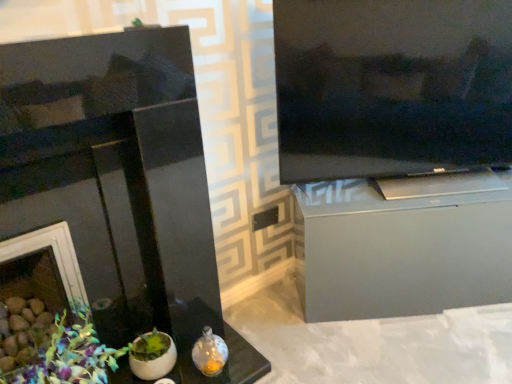
What is the approximate width of black glossy fireplace at left?

16.51 inches.

The height and width of the screenshot is (384, 512). What do you see at coordinates (120, 183) in the screenshot?
I see `black glossy fireplace at left` at bounding box center [120, 183].

This screenshot has width=512, height=384. What do you see at coordinates (72, 356) in the screenshot?
I see `matte green plant at lower left` at bounding box center [72, 356].

Find the location of `matte green plant at lower left`. matte green plant at lower left is located at coordinates (72, 356).

Locate an element on the screen. This screenshot has width=512, height=384. satin silver cabinet at right is located at coordinates (403, 245).

In the image, is black glossy television at upper right positioned in front of or behind satin silver cabinet at right?

black glossy television at upper right is in front of satin silver cabinet at right.

Based on the photo, is black glossy television at upper right facing towards satin silver cabinet at right?

No.

Is point (496, 160) positioned in front of point (390, 186)?

No, it is not.

Between black glossy television at upper right and black glossy fireplace at left, which one has smaller size?

black glossy television at upper right.

From the image's perspective, does black glossy television at upper right appear lower than black glossy fireplace at left?

No, from the image's perspective, black glossy television at upper right is not below black glossy fireplace at left.

Find the location of a particular element. This screenshot has height=384, width=512. fireplace that appears on the left of black glossy television at upper right is located at coordinates (120, 183).

Looking at this image, what's the angular difference between black glossy television at upper right and black glossy fireplace at left's facing directions?

They differ by 33.8 degrees in their facing directions.

Locate an element on the screen. cabinetry lying on the right of black glossy television at upper right is located at coordinates (403, 245).

Is satin silver cabinet at right looking in the opposite direction of black glossy television at upper right?

No, satin silver cabinet at right is not facing away from black glossy television at upper right.

In the scene shown: Is satin silver cabinet at right in front of black glossy television at upper right?

That is False.

Considering the sizes of matte green plant at lower left and satin silver cabinet at right in the image, is matte green plant at lower left wider or thinner than satin silver cabinet at right?

Considering their sizes, matte green plant at lower left looks broader than satin silver cabinet at right.

Is matte green plant at lower left with satin silver cabinet at right?

No, matte green plant at lower left is not next to satin silver cabinet at right.

Is the depth of matte green plant at lower left greater than that of satin silver cabinet at right?

No.

Which is behind, point (86, 320) or point (336, 243)?

The point (336, 243) is more distant.

Is matte green plant at lower left far from black glossy fireplace at left?

No, there isn't a large distance between matte green plant at lower left and black glossy fireplace at left.

From a real-world perspective, is matte green plant at lower left located higher than black glossy fireplace at left?

No, from a real-world perspective, matte green plant at lower left is not over black glossy fireplace at left

Image resolution: width=512 pixels, height=384 pixels. Find the location of `floral arrangement below the black glossy television at upper right (from the image's perspective)`. floral arrangement below the black glossy television at upper right (from the image's perspective) is located at coordinates (72, 356).

Does matte green plant at lower left have a larger size compared to black glossy television at upper right?

Incorrect, matte green plant at lower left is not larger than black glossy television at upper right.

Consider the image. Considering the sizes of matte green plant at lower left and black glossy television at upper right in the image, is matte green plant at lower left taller or shorter than black glossy television at upper right?

Clearly, matte green plant at lower left is shorter compared to black glossy television at upper right.

Which object is closer to the camera, matte green plant at lower left or black glossy television at upper right?

Positioned in front is matte green plant at lower left.

Is black glossy fireplace at left at the right side of matte green plant at lower left?

Indeed, black glossy fireplace at left is positioned on the right side of matte green plant at lower left.

From the image's perspective, which one is positioned lower, black glossy fireplace at left or matte green plant at lower left?

matte green plant at lower left, from the image's perspective.

Does black glossy fireplace at left have a greater height compared to matte green plant at lower left?

Yes.

Find the location of a particular element. fireplace above the matte green plant at lower left (from the image's perspective) is located at coordinates (120, 183).

In the image, there is a satin silver cabinet at right. What are the coordinates of `television above it (from the image's perspective)` in the screenshot? It's located at (391, 86).

At what (x,y) coordinates should I click in order to perform the action: click on television above the black glossy fireplace at left (from a real-world perspective). Please return your answer as a coordinate pair (x, y). The height and width of the screenshot is (384, 512). Looking at the image, I should click on (391, 86).

Looking at the image, which one is located closer to satin silver cabinet at right, black glossy television at upper right or black glossy fireplace at left?

Among the two, black glossy television at upper right is located nearer to satin silver cabinet at right.

From the image, which object appears to be farther from matte green plant at lower left, satin silver cabinet at right or black glossy television at upper right?

Based on the image, black glossy television at upper right appears to be further to matte green plant at lower left.

Consider the image. From the image, which object appears to be farther from black glossy television at upper right, satin silver cabinet at right or matte green plant at lower left?

The object further to black glossy television at upper right is matte green plant at lower left.

Which object lies nearer to the anchor point black glossy television at upper right, matte green plant at lower left or satin silver cabinet at right?

satin silver cabinet at right.

Which object lies nearer to the anchor point matte green plant at lower left, satin silver cabinet at right or black glossy fireplace at left?

black glossy fireplace at left is positioned closer to the anchor matte green plant at lower left.

Looking at the image, which one is located closer to matte green plant at lower left, black glossy television at upper right or satin silver cabinet at right?

The object closer to matte green plant at lower left is satin silver cabinet at right.

When comparing their distances from black glossy fireplace at left, does matte green plant at lower left or satin silver cabinet at right seem closer?

matte green plant at lower left.

Looking at the image, which one is located further to matte green plant at lower left, black glossy fireplace at left or black glossy television at upper right?

Based on the image, black glossy television at upper right appears to be further to matte green plant at lower left.

The image size is (512, 384). I want to click on fireplace located between matte green plant at lower left and satin silver cabinet at right in the left-right direction, so click(x=120, y=183).

You are a GUI agent. You are given a task and a screenshot of the screen. Output one action in this format:
    pyautogui.click(x=<x>, y=<y>)
    Task: Click on the television located between matte green plant at lower left and satin silver cabinet at right in the left-right direction
    
    Given the screenshot: What is the action you would take?
    pyautogui.click(x=391, y=86)

I want to click on television located between black glossy fireplace at left and satin silver cabinet at right in the left-right direction, so click(x=391, y=86).

Where is `fireplace located between matte green plant at lower left and black glossy television at upper right in the left-right direction`? The image size is (512, 384). fireplace located between matte green plant at lower left and black glossy television at upper right in the left-right direction is located at coordinates (120, 183).